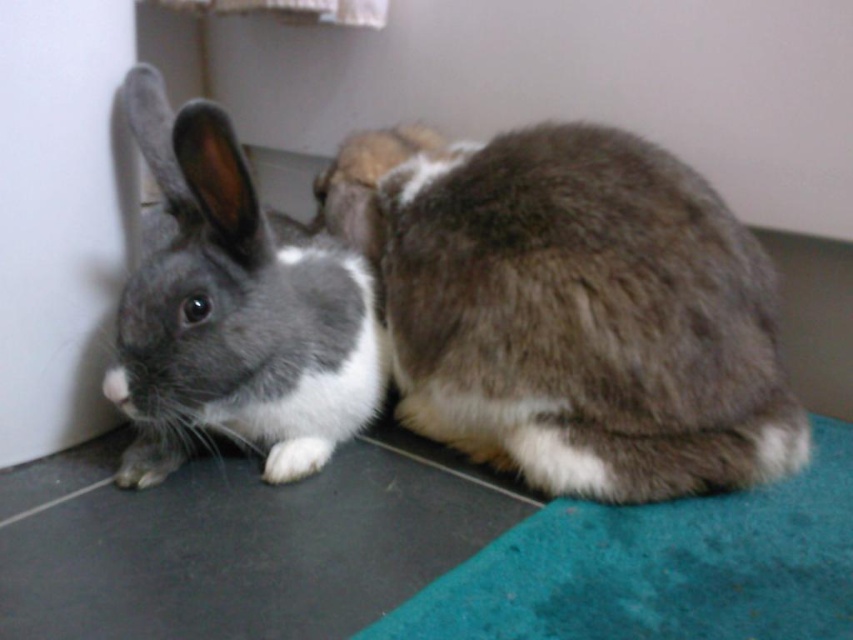
You are standing at the origin point in the image. Which direction should you move to reach the brown fuzzy rabbit at center?

The brown fuzzy rabbit at center is located at coordinates approximately 0.484 on the x axis and 0.671 on the y axis. Since you are at the origin, you should move right along the x axis and up along the y axis to reach it.

You are a pet owner trying to place a feeding bowl between the brown fuzzy rabbit at center and the matte gray rabbit at left. Can you estimate if there is enough space between them to fit a standard 15 cm diameter bowl?

The brown fuzzy rabbit at center might be wider than the matte gray rabbit at left, so the space between them may not be sufficient to fit a 15 cm diameter bowl. Check the actual distance before placing the bowl.